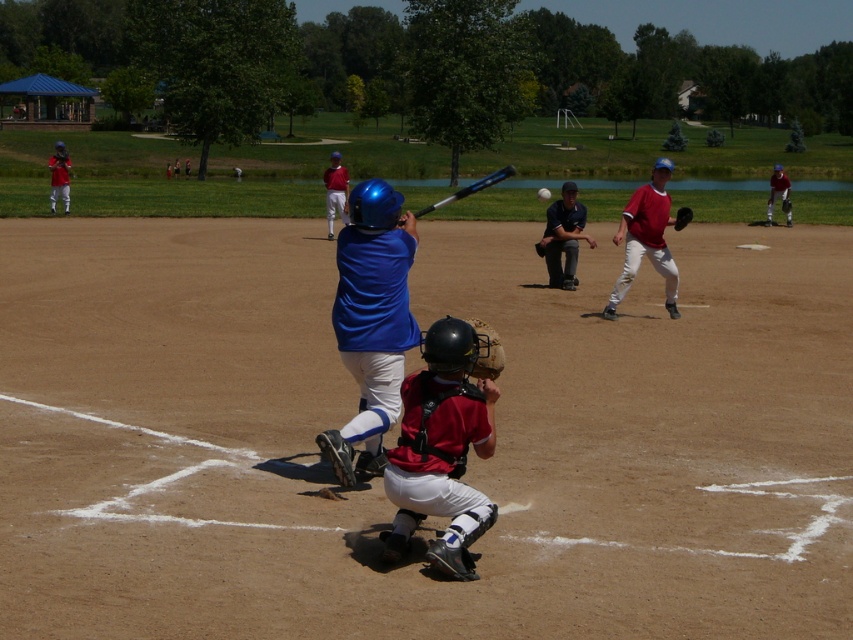
Is matte blue helmet at upper left behind brown leather glove at center?

Yes, it is.

Is point (67, 180) less distant than point (679, 214)?

No, it is not.

Where is `matte blue helmet at upper left`? matte blue helmet at upper left is located at coordinates (59, 177).

Does brown leather glove at lower center have a lesser width compared to white matte baseball at center?

Correct, brown leather glove at lower center's width is less than white matte baseball at center's.

Does brown leather glove at lower center appear over white matte baseball at center?

No.

This screenshot has width=853, height=640. What are the coordinates of `brown leather glove at lower center` in the screenshot? It's located at (486, 349).

Is red matte baseball glove at center below matte blue helmet at upper center?

Indeed, red matte baseball glove at center is positioned under matte blue helmet at upper center.

Who is more distant from viewer, (669,260) or (343,170)?

Positioned behind is point (343,170).

Identify the location of red matte baseball glove at center. The image size is (853, 640). (646, 237).

I want to click on red matte baseball glove at center, so click(646, 237).